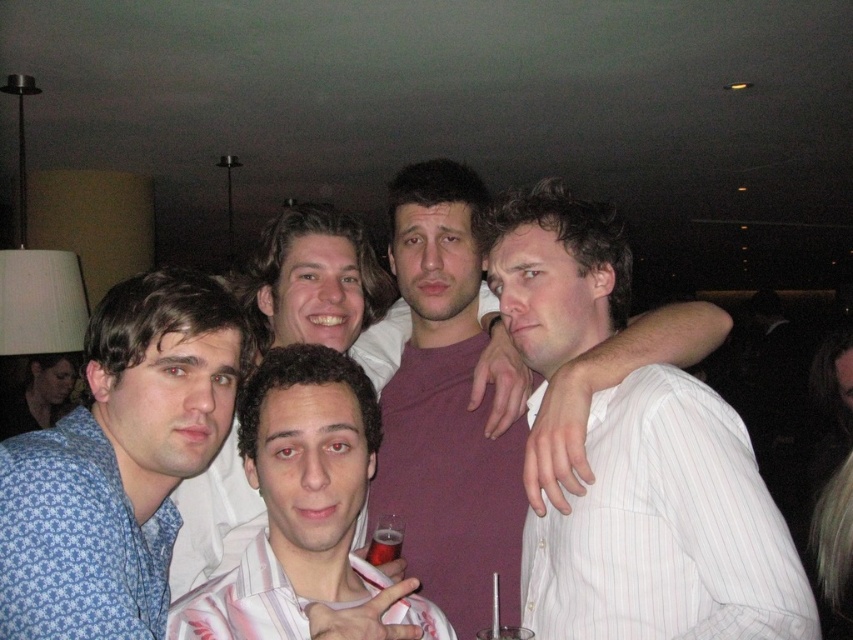
Which is in front, point (630, 445) or point (374, 588)?

Positioned in front is point (630, 445).

Is white pinstriped shirt at right shorter than white striped shirt at center?

No.

Describe the element at coordinates (665, 529) in the screenshot. The height and width of the screenshot is (640, 853). I see `white pinstriped shirt at right` at that location.

Identify the location of white pinstriped shirt at right. The height and width of the screenshot is (640, 853). (665, 529).

Does matte purple shirt at center lie in front of translucent plastic cup at center?

Yes, matte purple shirt at center is in front of translucent plastic cup at center.

Which is below, matte purple shirt at center or translucent plastic cup at center?

translucent plastic cup at center is below.

The image size is (853, 640). What do you see at coordinates (479, 397) in the screenshot?
I see `matte purple shirt at center` at bounding box center [479, 397].

The width and height of the screenshot is (853, 640). I want to click on matte purple shirt at center, so click(x=479, y=397).

Can you confirm if blue patterned shirt at left is positioned to the left of translucent plastic cup at center?

Yes, blue patterned shirt at left is to the left of translucent plastic cup at center.

Which is behind, point (196, 417) or point (376, 544)?

The point (376, 544) is behind.

This screenshot has height=640, width=853. I want to click on blue patterned shirt at left, so click(x=119, y=461).